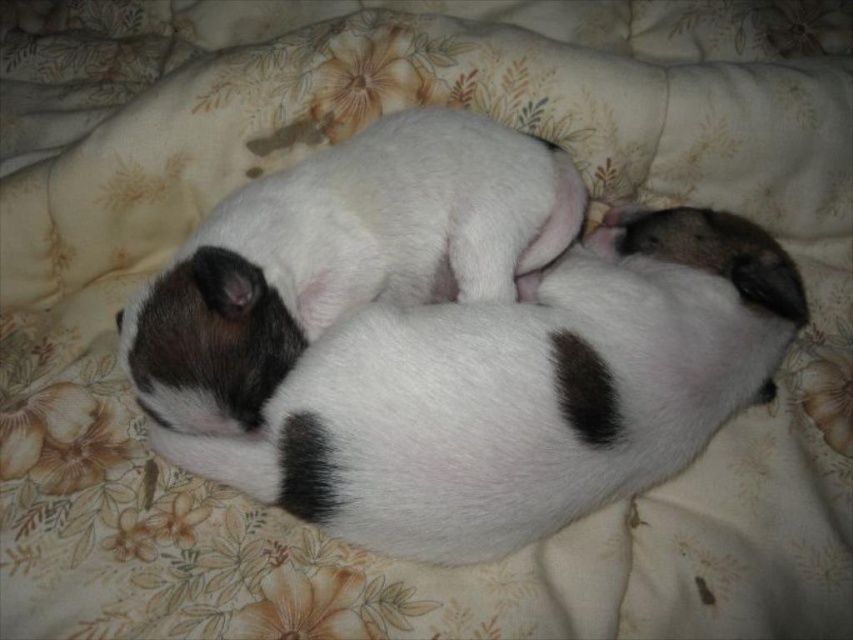
Question: Where is white soft fur dog at center located in relation to white fur dog at center in the image?

Choices:
 (A) right
 (B) left

Answer: (A)

Question: Can you confirm if white soft fur dog at center is wider than white fur dog at center?

Choices:
 (A) yes
 (B) no

Answer: (A)

Question: Which point is closer to the camera?

Choices:
 (A) white fur dog at center
 (B) white soft fur dog at center

Answer: (B)

Question: Is white soft fur dog at center smaller than white fur dog at center?

Choices:
 (A) no
 (B) yes

Answer: (A)